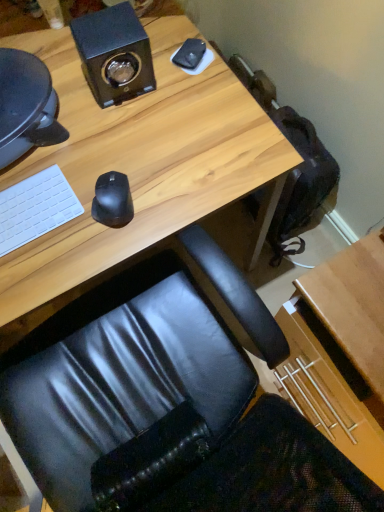
Where is `vacant area that lies to the right of black matte speaker at upper left`? The height and width of the screenshot is (512, 384). vacant area that lies to the right of black matte speaker at upper left is located at coordinates (187, 88).